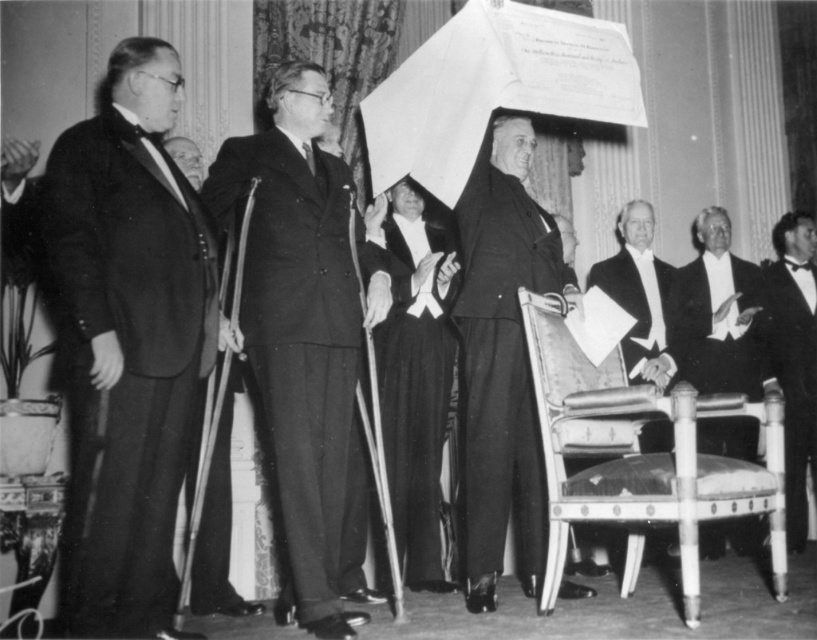
Question: Which point is closer to the camera?

Choices:
 (A) (166, 621)
 (B) (472, 524)
 (C) (230, 166)
 (D) (759, 307)

Answer: (A)

Question: Is matte black suit at center bigger than white tuxedo at right?

Choices:
 (A) no
 (B) yes

Answer: (B)

Question: Which object is farther from the camera taking this photo?

Choices:
 (A) smooth black suit at center
 (B) leather upholstered chair at lower right

Answer: (A)

Question: Is smooth black suit at left below smooth black suit at center?

Choices:
 (A) yes
 (B) no

Answer: (A)

Question: Among these points, which one is farthest from the camera?

Choices:
 (A) (311, 216)
 (B) (534, 456)
 (C) (676, 362)

Answer: (C)

Question: Is smooth black suit at center wider than white satin suit at right?

Choices:
 (A) yes
 (B) no

Answer: (A)